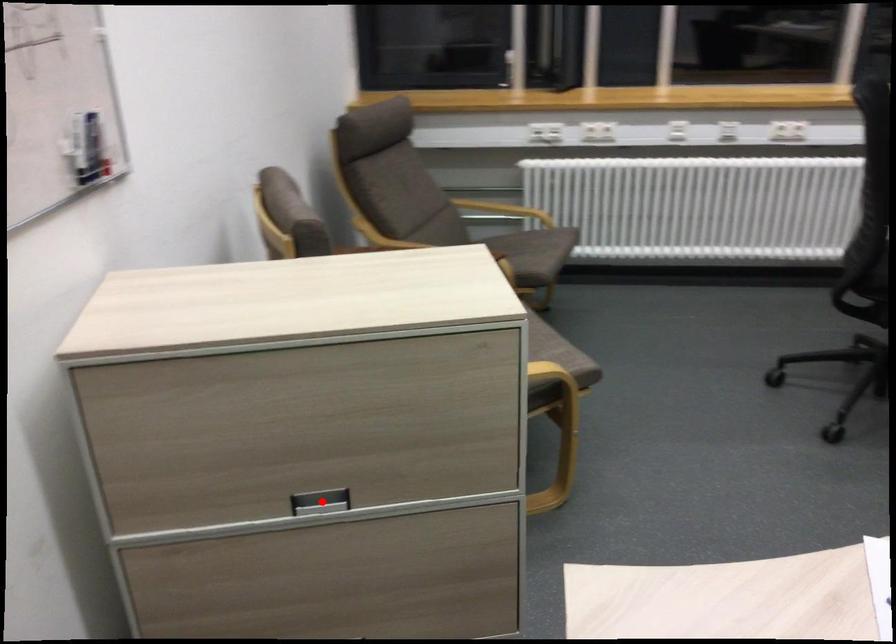
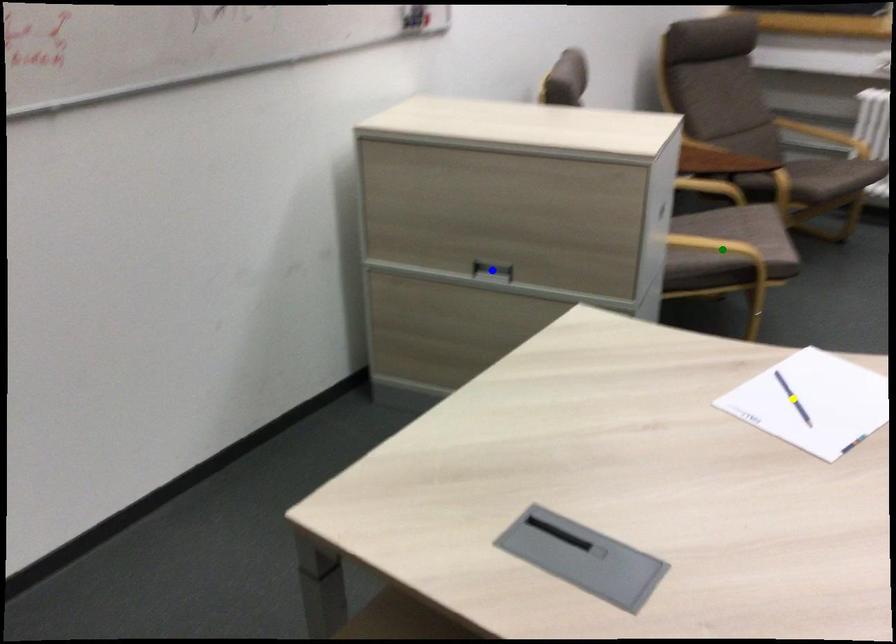
Question: I am providing you with two images of the same scene from different viewpoints. A red point is marked on the first image. You are given multiple points on the second image. In image 2, which mark is for the same physical point as the one in image 1?

Choices:
 (A) blue point
 (B) yellow point
 (C) green point

Answer: (A)